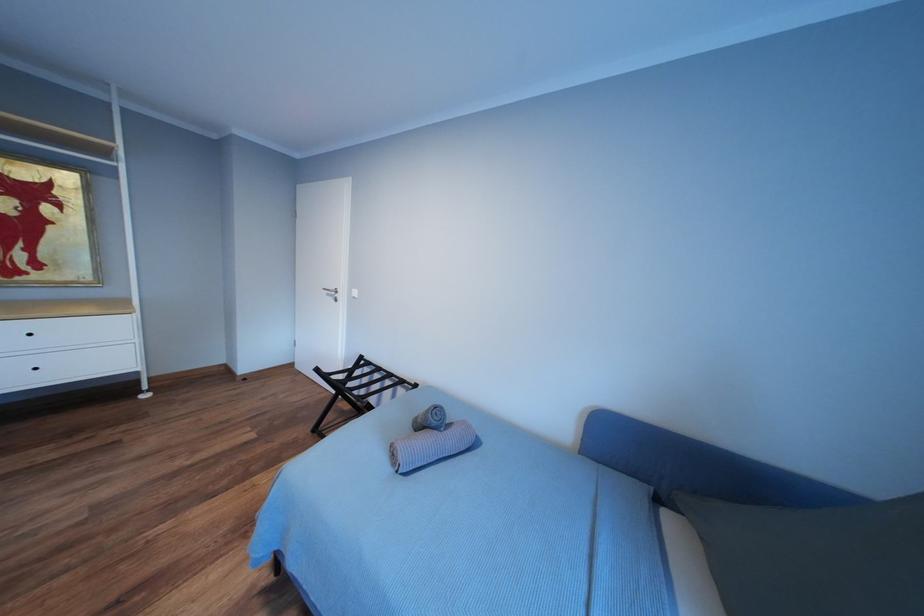
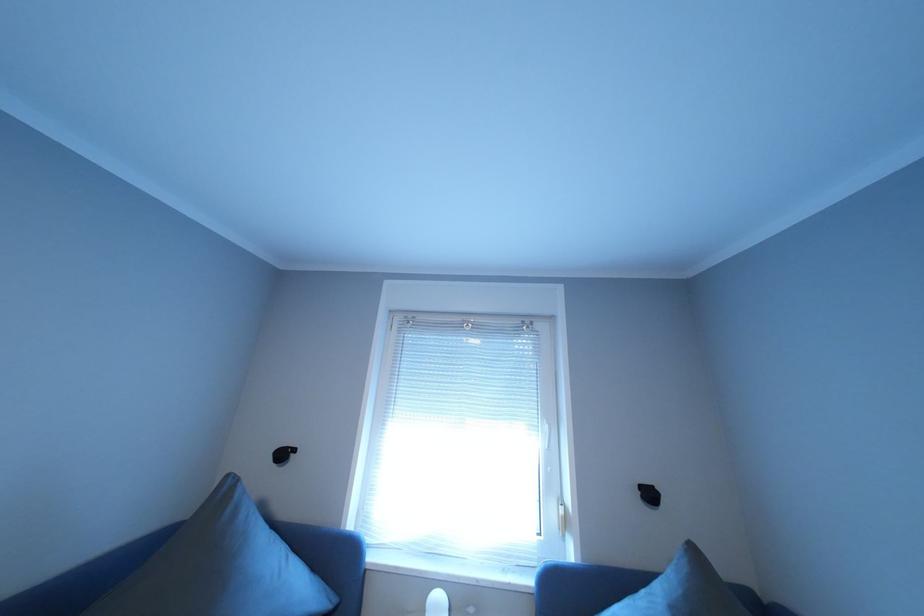
Question: The camera is either moving clockwise (left) or counter-clockwise (right) around the object. The first image is from the beginning of the video and the second image is from the end. Is the camera moving left or right when shooting the video?

Choices:
 (A) Left
 (B) Right

Answer: (A)